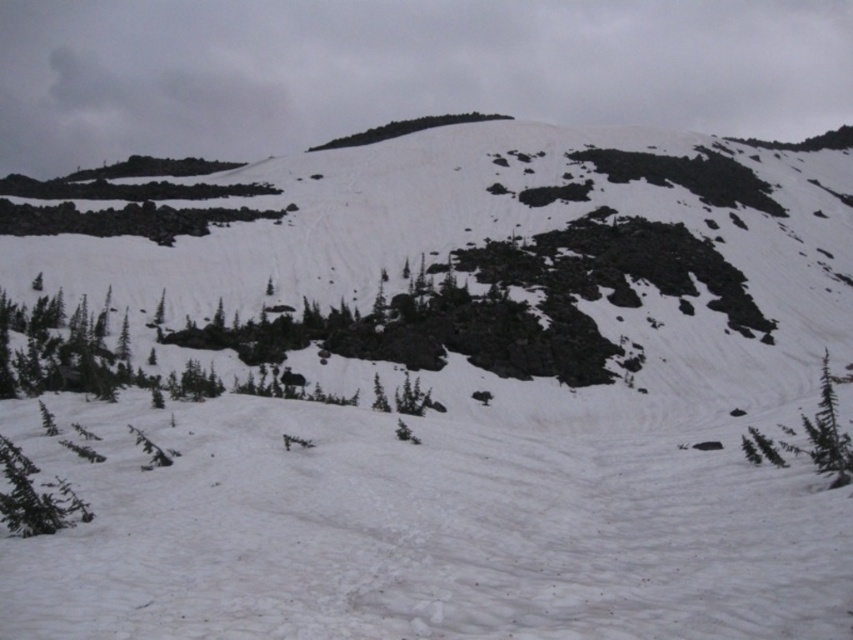
Question: Where is green matte tree at lower left located in relation to green leafy tree at lower right in the image?

Choices:
 (A) right
 (B) left

Answer: (B)

Question: Which point appears closest to the camera in this image?

Choices:
 (A) (813, 436)
 (B) (315, 148)
 (C) (67, 506)

Answer: (C)

Question: Which object appears farthest from the camera in this image?

Choices:
 (A) green matte tree at lower left
 (B) green leafy tree at lower right
 (C) green leafy tree at upper center

Answer: (C)

Question: Is green matte tree at lower left positioned before green leafy tree at upper center?

Choices:
 (A) yes
 (B) no

Answer: (A)

Question: Observing the image, what is the correct spatial positioning of green matte tree at lower left in reference to green leafy tree at upper center?

Choices:
 (A) below
 (B) above

Answer: (A)

Question: Which point is closer to the camera taking this photo?

Choices:
 (A) (815, 440)
 (B) (434, 118)
 (C) (22, 490)

Answer: (C)